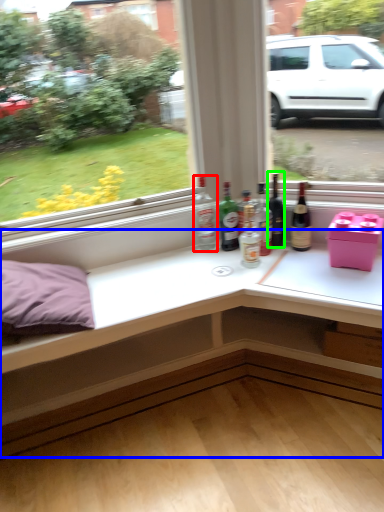
Question: Which object is positioned farthest from bottle (highlighted by a red box)? Select from table (highlighted by a blue box) and beer bottle (highlighted by a green box).

Choices:
 (A) table
 (B) beer bottle

Answer: (A)